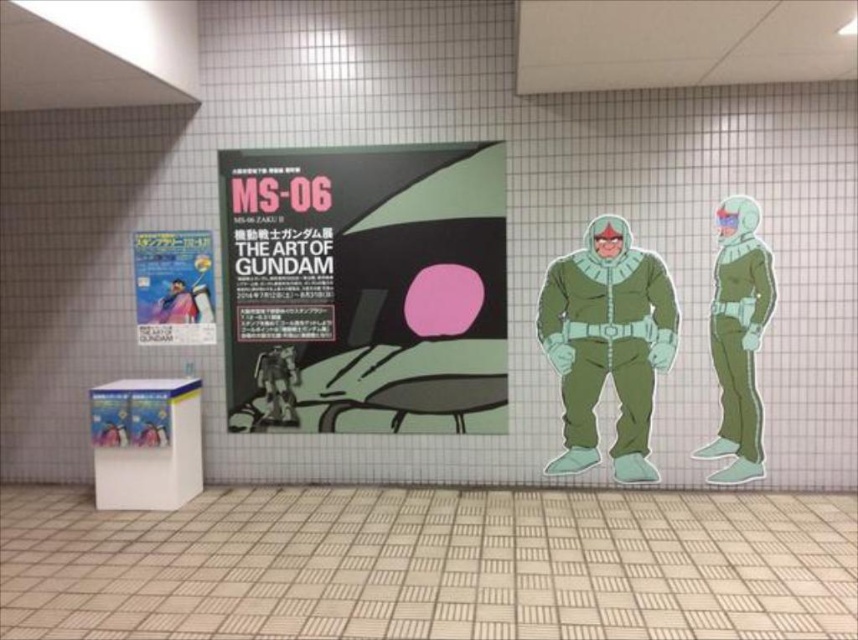
Does point (456, 248) come in front of point (176, 284)?

Yes, it is.

Can you confirm if matte black poster at center is wider than matte paper poster at left?

Yes, matte black poster at center is wider than matte paper poster at left.

Does point (369, 371) come closer to viewer compared to point (144, 340)?

That is True.

This screenshot has height=640, width=858. Find the location of `matte black poster at center`. matte black poster at center is located at coordinates (367, 284).

Who is more forward, (x=289, y=214) or (x=716, y=253)?

Point (x=716, y=253) is more forward.

Which is more to the left, matte black poster at center or green matte astronaut suit at right?

From the viewer's perspective, matte black poster at center appears more on the left side.

Identify the location of matte black poster at center. The height and width of the screenshot is (640, 858). (x=367, y=284).

Is green matte astronaut suit at right thinner than blue fabric scarf at center?

In fact, green matte astronaut suit at right might be wider than blue fabric scarf at center.

Can you confirm if green matte astronaut suit at right is smaller than blue fabric scarf at center?

Actually, green matte astronaut suit at right might be larger than blue fabric scarf at center.

Does point (723, 257) come behind point (189, 301)?

No, it is not.

Identify the location of green matte astronaut suit at right. (738, 339).